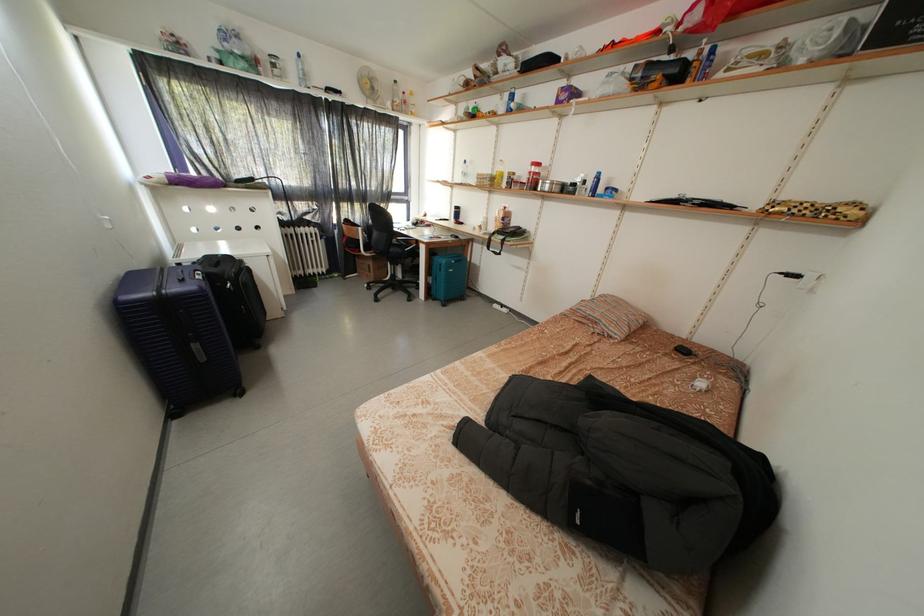
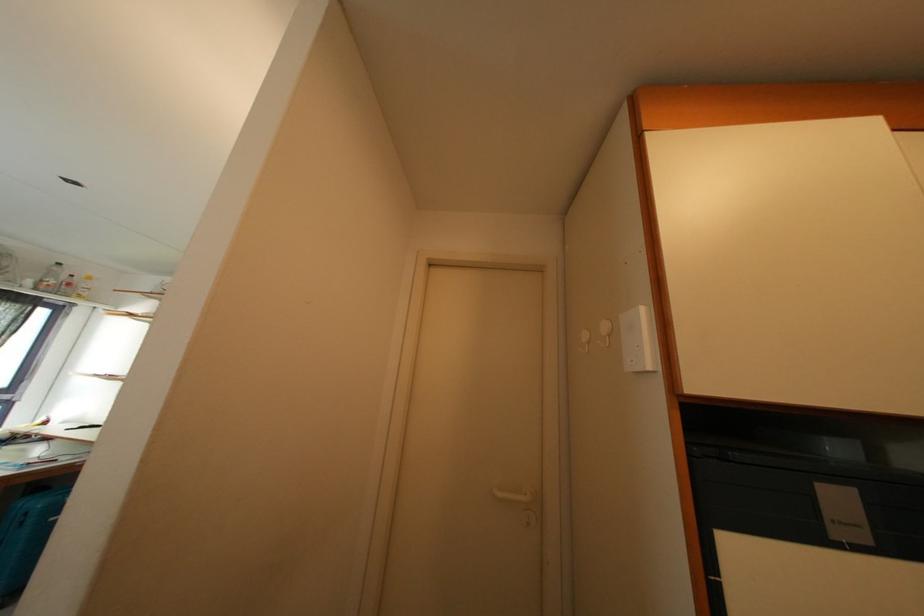
The point at (396, 108) is marked in the first image. Where is the corresponding point in the second image?

(38, 286)